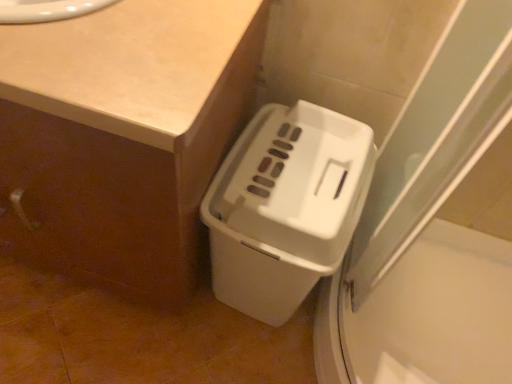
This screenshot has height=384, width=512. What are the coordinates of `white matte counter at lower right` in the screenshot? It's located at pyautogui.click(x=122, y=135).

In order to face white plastic waste container at lower right, should I rotate leftwards or rightwards?

Rotate your view right by about 4.063°.

Identify the location of white matte counter at lower right. (122, 135).

Is beige laminate counter at upper left at the back of white plastic waste container at lower right?

No, white plastic waste container at lower right is not facing away from beige laminate counter at upper left.

Where is `waste container lying behind the beige laminate counter at upper left`? This screenshot has width=512, height=384. waste container lying behind the beige laminate counter at upper left is located at coordinates click(x=286, y=207).

Between point (350, 237) and point (139, 44), which one is positioned in front?

Point (139, 44)

Is beige laminate counter at upper left far away from white matte counter at lower right?

No.

Considering the relative positions of beige laminate counter at upper left and white matte counter at lower right in the image provided, is beige laminate counter at upper left behind white matte counter at lower right?

Yes, it is.

Is beige laminate counter at upper left facing away from white matte counter at lower right?

Yes, beige laminate counter at upper left is facing away from white matte counter at lower right.

In terms of height, does beige laminate counter at upper left look taller or shorter compared to white matte counter at lower right?

beige laminate counter at upper left is shorter than white matte counter at lower right.

Which is correct: beige laminate counter at upper left is inside white plastic waste container at lower right, or outside of it?

beige laminate counter at upper left is not enclosed by white plastic waste container at lower right.

What are the coordinates of `counter top located above the white plastic waste container at lower right (from the image's perspective)` in the screenshot? It's located at (126, 64).

Which object is more forward, beige laminate counter at upper left or white plastic waste container at lower right?

beige laminate counter at upper left is more forward.

From the image's perspective, does beige laminate counter at upper left appear lower than white plastic waste container at lower right?

Actually, beige laminate counter at upper left appears above white plastic waste container at lower right in the image.

This screenshot has width=512, height=384. Find the location of `counter beneath the beige laminate counter at upper left (from a real-world perspective)`. counter beneath the beige laminate counter at upper left (from a real-world perspective) is located at coordinates (122, 135).

Between white matte counter at lower right and beige laminate counter at upper left, which one appears on the right side from the viewer's perspective?

beige laminate counter at upper left is more to the right.

From the image's perspective, would you say white matte counter at lower right is positioned over beige laminate counter at upper left?

No, from the image's perspective, white matte counter at lower right is not on top of beige laminate counter at upper left.

Between white plastic waste container at lower right and white matte counter at lower right, which one is positioned behind?

white plastic waste container at lower right is further from the camera.

From a real-world perspective, who is located lower, white plastic waste container at lower right or white matte counter at lower right?

white plastic waste container at lower right.

Is white plastic waste container at lower right turned away from white matte counter at lower right?

No, white plastic waste container at lower right is not facing away from white matte counter at lower right.

Consider the image. Would you say white matte counter at lower right contains white plastic waste container at lower right?

No, white matte counter at lower right does not contain white plastic waste container at lower right.

Considering the points (23, 247) and (341, 230), which point is behind, point (23, 247) or point (341, 230)?

The point (23, 247) is more distant.

Considering the relative positions of white matte counter at lower right and white plastic waste container at lower right in the image provided, is white matte counter at lower right to the left or to the right of white plastic waste container at lower right?

Clearly, white matte counter at lower right is on the left of white plastic waste container at lower right in the image.

Considering the relative sizes of white matte counter at lower right and white plastic waste container at lower right in the image provided, is white matte counter at lower right shorter than white plastic waste container at lower right?

In fact, white matte counter at lower right may be taller than white plastic waste container at lower right.

Locate an element on the screen. The image size is (512, 384). counter top in front of the white plastic waste container at lower right is located at coordinates (126, 64).

Locate an element on the screen. This screenshot has height=384, width=512. counter top that appears above the white matte counter at lower right (from the image's perspective) is located at coordinates (126, 64).

Which object lies nearer to the anchor point beige laminate counter at upper left, white plastic waste container at lower right or white matte counter at lower right?

white matte counter at lower right is positioned closer to the anchor beige laminate counter at upper left.

When comparing their distances from white matte counter at lower right, does beige laminate counter at upper left or white plastic waste container at lower right seem further?

Among the two, white plastic waste container at lower right is located further to white matte counter at lower right.

When comparing their distances from white plastic waste container at lower right, does beige laminate counter at upper left or white matte counter at lower right seem closer?

white matte counter at lower right is positioned closer to the anchor white plastic waste container at lower right.

Based on their spatial positions, is white matte counter at lower right or white plastic waste container at lower right closer to beige laminate counter at upper left?

white matte counter at lower right is positioned closer to the anchor beige laminate counter at upper left.

Which object lies nearer to the anchor point white plastic waste container at lower right, white matte counter at lower right or beige laminate counter at upper left?

white matte counter at lower right.

Considering their positions, is white plastic waste container at lower right positioned closer to white matte counter at lower right than beige laminate counter at upper left?

The object closer to white matte counter at lower right is beige laminate counter at upper left.

Image resolution: width=512 pixels, height=384 pixels. Identify the location of counter top between white matte counter at lower right and white plastic waste container at lower right from left to right. (126, 64).